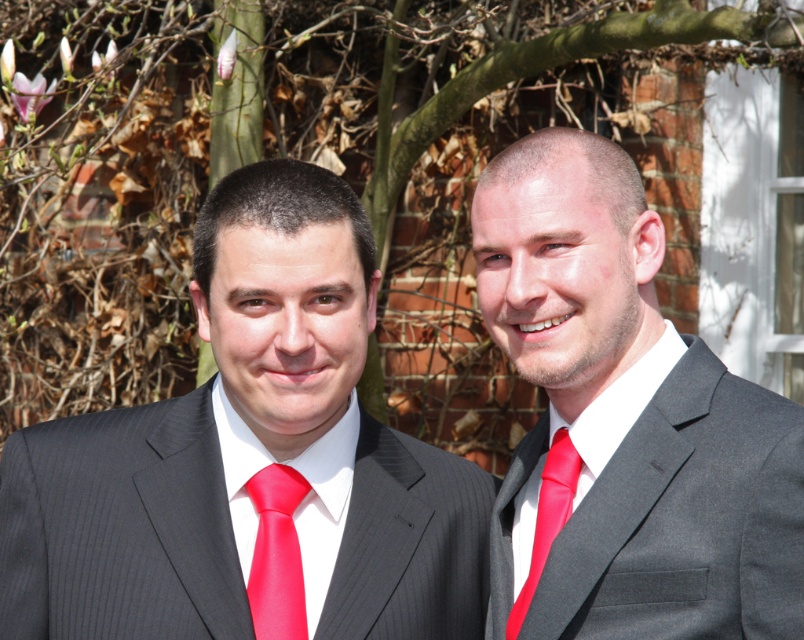
Is point (316, 561) positioned before point (273, 547)?

No, (316, 561) is behind (273, 547).

Where is `matte black suit at left`? matte black suit at left is located at coordinates (249, 461).

Does matte black suit at left appear on the left side of matte red tie at right?

→ Yes, matte black suit at left is to the left of matte red tie at right.

Based on the photo, measure the distance between point (347, 422) and camera.

Point (347, 422) is 5.43 meters away from camera.

This screenshot has height=640, width=804. In order to click on matte black suit at left in this screenshot , I will do `click(249, 461)`.

Does point (573, 196) lie behind point (255, 557)?

No, (573, 196) is in front of (255, 557).

Who is lower down, matte black suit at center or red satin tie at center?

red satin tie at center is lower down.

Between point (700, 532) and point (298, 480), which one is positioned in front?

Point (700, 532) is more forward.

Locate an element on the screen. matte black suit at center is located at coordinates (624, 422).